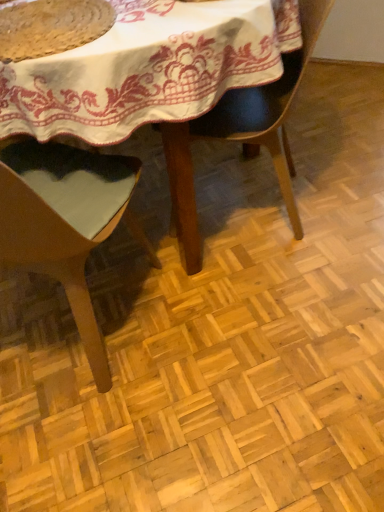
Find the location of `vacant space to the right of matte black chair at center, the 2th chair in the left-to-right sequence`. vacant space to the right of matte black chair at center, the 2th chair in the left-to-right sequence is located at coordinates (339, 186).